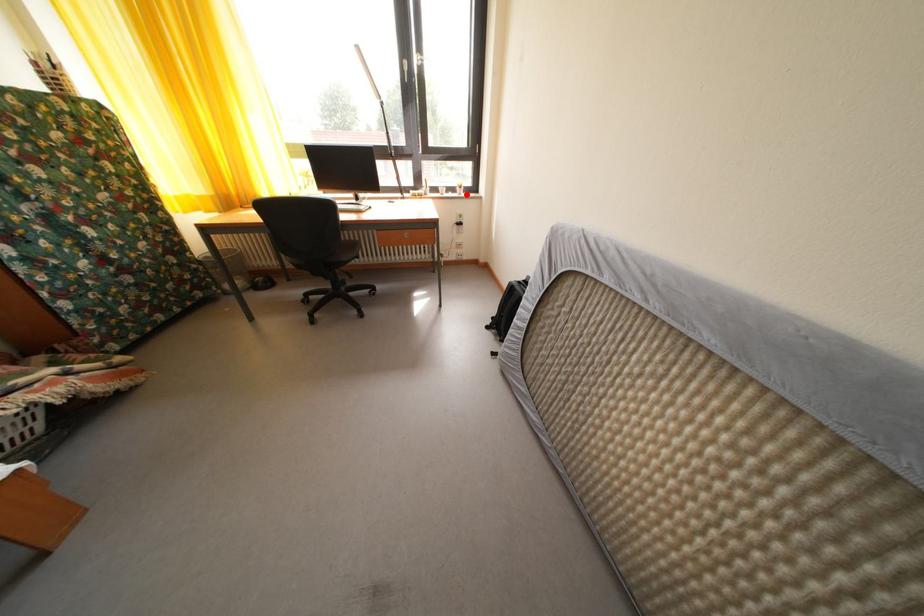
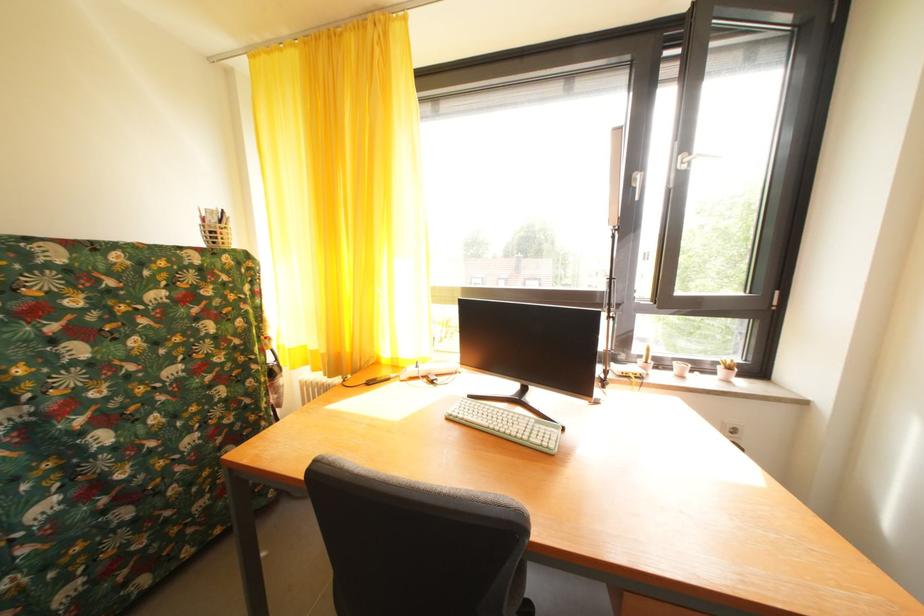
The point at the highlighted location is marked in the first image. Where is the corresponding point in the second image?

(728, 374)